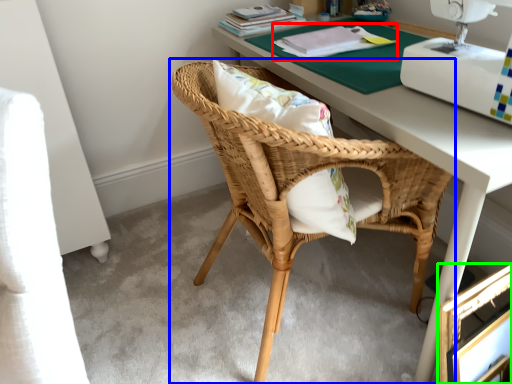
Question: Which object is positioned farthest from book (highlighted by a red box)? Select from chair (highlighted by a blue box) and picture frame (highlighted by a green box).

Choices:
 (A) chair
 (B) picture frame

Answer: (B)